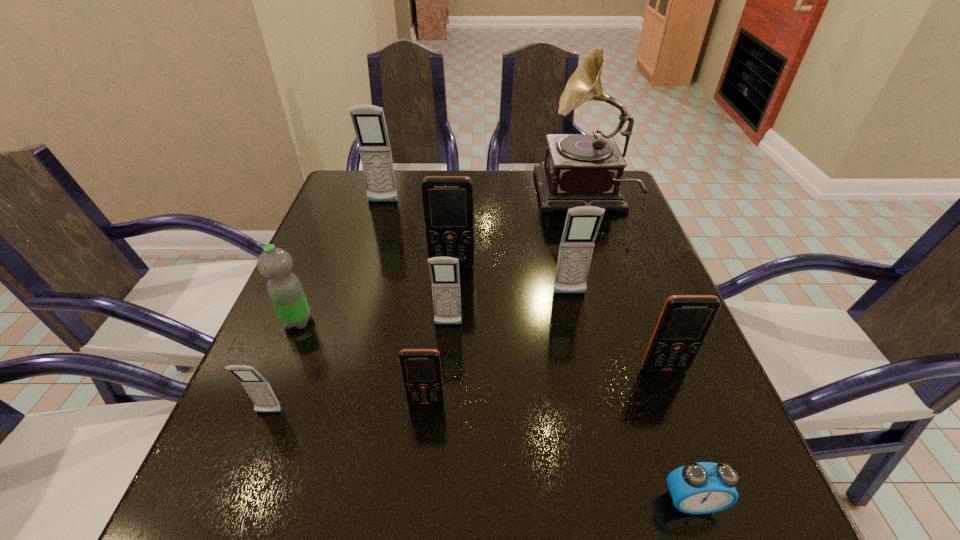
Identify the location of unoccupied area between the second biggest orange cellular telephone and the smallest gray cellular telephone. The width and height of the screenshot is (960, 540). point(467,391).

The width and height of the screenshot is (960, 540). Find the location of `free space between the nearest object and the fourth farthest cellular telephone`. free space between the nearest object and the fourth farthest cellular telephone is located at coordinates (570, 413).

Choose which object is the nearest neighbor to the green water bottle. Please provide its 2D coordinates. Your answer should be formatted as a tuple, i.e. [(x, y)], where the tuple contains the x and y coordinates of a point satisfying the conditions above.

[(259, 390)]

Point out which object is positioned as the second nearest to the third biggest gray cellular telephone. Please provide its 2D coordinates. Your answer should be formatted as a tuple, i.e. [(x, y)], where the tuple contains the x and y coordinates of a point satisfying the conditions above.

[(447, 200)]

Where is `cellular telephone that is the third nearest to the second farthest orange cellular telephone`? The width and height of the screenshot is (960, 540). cellular telephone that is the third nearest to the second farthest orange cellular telephone is located at coordinates (421, 368).

The width and height of the screenshot is (960, 540). I want to click on the second closest cellular telephone to the second nearest orange cellular telephone, so click(x=444, y=271).

Find the location of `gray cellular telephone that can be found as the third closest to the third nearest object`. gray cellular telephone that can be found as the third closest to the third nearest object is located at coordinates (582, 223).

Choose which gray cellular telephone is the nearest neighbor to the biggest orange cellular telephone. Please provide its 2D coordinates. Your answer should be formatted as a tuple, i.e. [(x, y)], where the tuple contains the x and y coordinates of a point satisfying the conditions above.

[(444, 271)]

Identify which orange cellular telephone is the second nearest to the shortest object. Please provide its 2D coordinates. Your answer should be formatted as a tuple, i.e. [(x, y)], where the tuple contains the x and y coordinates of a point satisfying the conditions above.

[(421, 368)]

At what (x,y) coordinates should I click in order to perform the action: click on orange cellular telephone that stands as the second closest to the second gray cellular telephone from left to right. Please return your answer as a coordinate pair (x, y). This screenshot has width=960, height=540. Looking at the image, I should click on (421, 368).